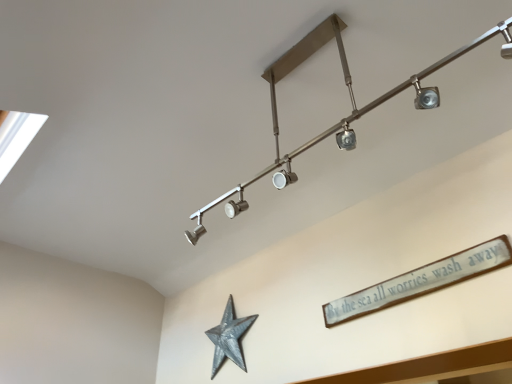
Locate an element on the screen. Image resolution: width=512 pixels, height=384 pixels. white wooden sign at upper right is located at coordinates (420, 281).

Which object is thinner, galvanized metal star at lower center or satin nickel track light at upper center?

Thinner between the two is galvanized metal star at lower center.

From their relative heights in the image, would you say galvanized metal star at lower center is taller or shorter than satin nickel track light at upper center?

Clearly, galvanized metal star at lower center is shorter compared to satin nickel track light at upper center.

Is galvanized metal star at lower center situated inside white wooden sign at upper right or outside?

galvanized metal star at lower center cannot be found inside white wooden sign at upper right.

Who is smaller, galvanized metal star at lower center or white wooden sign at upper right?

white wooden sign at upper right.

Between point (229, 335) and point (470, 254), which one is positioned behind?

The point (229, 335) is farther from the camera.

From the picture: Is satin nickel track light at upper center inside the boundaries of galvanized metal star at lower center, or outside?

satin nickel track light at upper center is outside galvanized metal star at lower center.

Considering the sizes of objects satin nickel track light at upper center and galvanized metal star at lower center in the image provided, who is thinner, satin nickel track light at upper center or galvanized metal star at lower center?

galvanized metal star at lower center.

From a real-world perspective, is satin nickel track light at upper center under galvanized metal star at lower center?

No, from a real-world perspective, satin nickel track light at upper center is not below galvanized metal star at lower center.

Which is in front, satin nickel track light at upper center or galvanized metal star at lower center?

satin nickel track light at upper center is closer to the camera.

Considering the sizes of white wooden sign at upper right and satin nickel track light at upper center in the image, is white wooden sign at upper right wider or thinner than satin nickel track light at upper center?

Clearly, white wooden sign at upper right has less width compared to satin nickel track light at upper center.

How many degrees apart are the facing directions of white wooden sign at upper right and satin nickel track light at upper center?

The angle between the facing direction of white wooden sign at upper right and the facing direction of satin nickel track light at upper center is 2.55 degrees.

Is white wooden sign at upper right to the right of satin nickel track light at upper center from the viewer's perspective?

Yes, white wooden sign at upper right is to the right of satin nickel track light at upper center.

From the image's perspective, relative to galvanized metal star at lower center, is white wooden sign at upper right above or below?

Clearly, from the image's perspective, white wooden sign at upper right is above galvanized metal star at lower center.

Are white wooden sign at upper right and galvanized metal star at lower center located far from each other?

No, white wooden sign at upper right is not far from galvanized metal star at lower center.

Can you tell me how much white wooden sign at upper right and galvanized metal star at lower center differ in facing direction?

The angle between the facing direction of white wooden sign at upper right and the facing direction of galvanized metal star at lower center is 0.498 degrees.

Which is in front, point (348, 311) or point (228, 347)?

The point (348, 311) is more forward.

Is satin nickel track light at upper center facing away from white wooden sign at upper right?

Yes, satin nickel track light at upper center is facing away from white wooden sign at upper right.

Is the depth of satin nickel track light at upper center greater than that of white wooden sign at upper right?

That is False.

Which is closer, (278, 186) or (440, 270)?

Positioned in front is point (278, 186).

Image resolution: width=512 pixels, height=384 pixels. What are the coordinates of `star behind the satin nickel track light at upper center` in the screenshot? It's located at (229, 337).

Where is `star above the white wooden sign at upper right (from a real-world perspective)`? The height and width of the screenshot is (384, 512). star above the white wooden sign at upper right (from a real-world perspective) is located at coordinates (229, 337).

Which object lies further to the anchor point white wooden sign at upper right, satin nickel track light at upper center or galvanized metal star at lower center?

galvanized metal star at lower center is further to white wooden sign at upper right.

Considering their positions, is galvanized metal star at lower center positioned closer to satin nickel track light at upper center than white wooden sign at upper right?

white wooden sign at upper right is closer to satin nickel track light at upper center.

Looking at the image, which one is located further to white wooden sign at upper right, galvanized metal star at lower center or satin nickel track light at upper center?

galvanized metal star at lower center lies further to white wooden sign at upper right than the other object.

Looking at the image, which one is located further to galvanized metal star at lower center, white wooden sign at upper right or satin nickel track light at upper center?

Among the two, satin nickel track light at upper center is located further to galvanized metal star at lower center.

From the image, which object appears to be farther from galvanized metal star at lower center, satin nickel track light at upper center or white wooden sign at upper right?

satin nickel track light at upper center.

Considering their positions, is white wooden sign at upper right positioned further to satin nickel track light at upper center than galvanized metal star at lower center?

Based on the image, galvanized metal star at lower center appears to be further to satin nickel track light at upper center.

You are a GUI agent. You are given a task and a screenshot of the screen. Output one action in this format:
    pyautogui.click(x=<x>, y=<y>)
    Task: Click on the writing between satin nickel track light at upper center and galvanized metal star at lower center from front to back
    
    Given the screenshot: What is the action you would take?
    pyautogui.click(x=420, y=281)